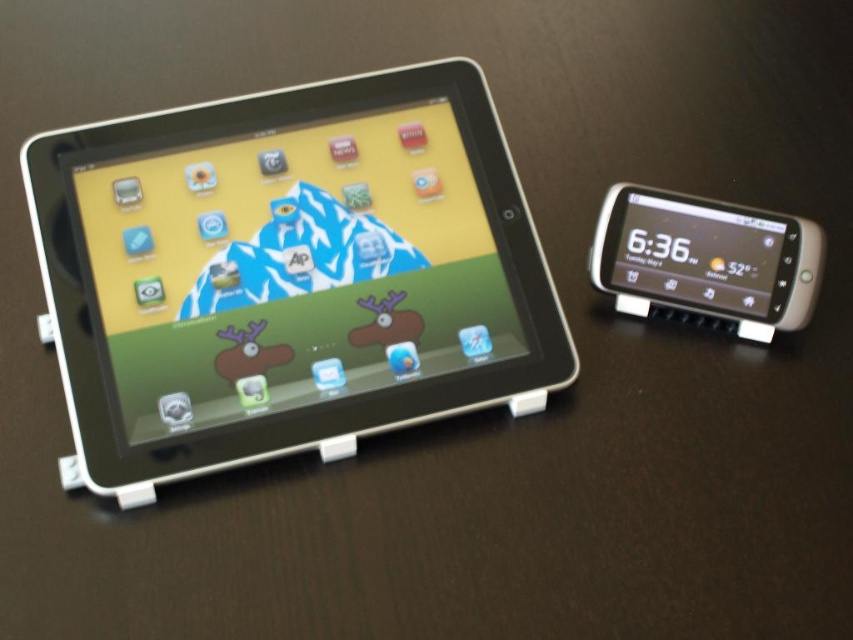
You are trying to locate the black plastic tablet at left in the image. What are the coordinates where you can find it?

The black plastic tablet at left can be found at coordinates point (289, 273).